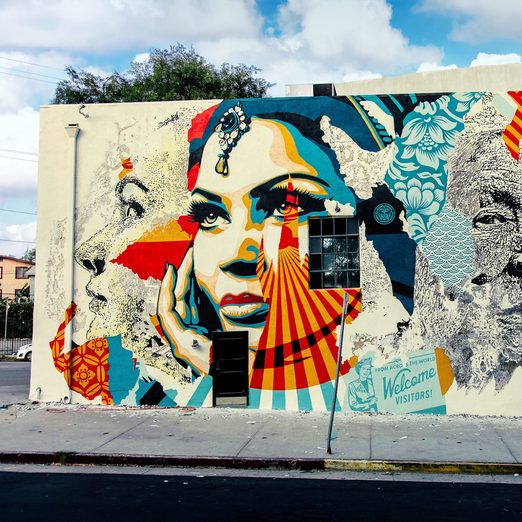
Where is `silver plate on door`? silver plate on door is located at coordinates (229, 402).